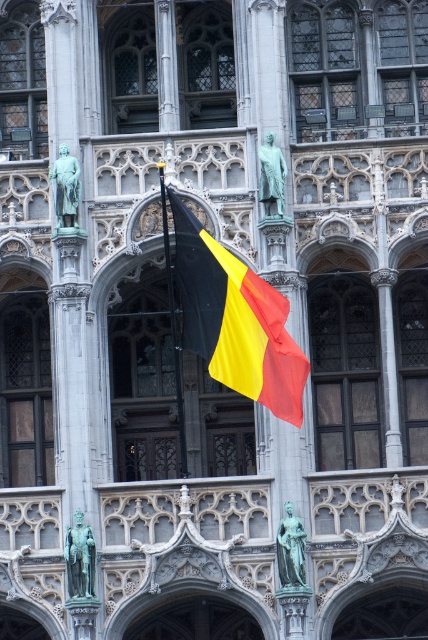
Question: Which of these objects is positioned closest to the green patinated bronze statue at upper left?

Choices:
 (A) bronze statue at upper center
 (B) bronze statue at center
 (C) green patinated bronze statue at center

Answer: (A)

Question: Which of these objects is positioned farthest from the green patinated bronze statue at upper left?

Choices:
 (A) bronze statue at upper center
 (B) black matte flag at center
 (C) green patinated bronze statue at center
 (D) bronze statue at center

Answer: (D)

Question: Which point appears farthest from the camera in this image?

Choices:
 (A) (59, 172)
 (B) (247, 332)
 (C) (291, 564)
 (D) (279, 166)

Answer: (A)

Question: Can you confirm if green patinated bronze statue at center is positioned to the left of bronze statue at upper center?

Choices:
 (A) no
 (B) yes

Answer: (B)

Question: In this image, where is black matte flag at center located relative to green patinated bronze statue at upper left?

Choices:
 (A) above
 (B) below

Answer: (B)

Question: Is bronze statue at center closer to the viewer compared to green patinated bronze statue at upper left?

Choices:
 (A) yes
 (B) no

Answer: (A)